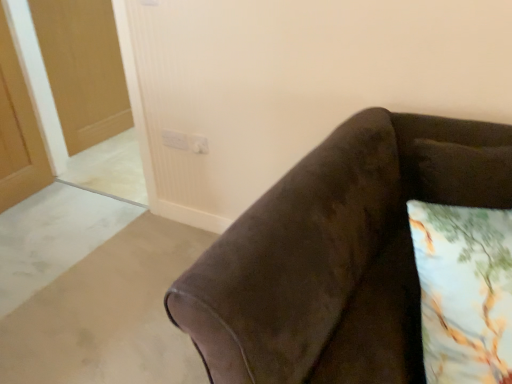
Question: Considering the relative positions of white plastic electric outlet at upper center, which is counted as the first electric outlet, starting from the left, and printed fabric pillow at lower right in the image provided, is white plastic electric outlet at upper center, which is counted as the first electric outlet, starting from the left, to the right of printed fabric pillow at lower right from the viewer's perspective?

Choices:
 (A) no
 (B) yes

Answer: (A)

Question: Is white plastic electric outlet at upper center, which is counted as the first electric outlet, starting from the left, facing away from printed fabric pillow at lower right?

Choices:
 (A) no
 (B) yes

Answer: (A)

Question: Does white plastic electric outlet at upper center, which is counted as the second electric outlet, starting from the right, have a larger size compared to printed fabric pillow at lower right?

Choices:
 (A) yes
 (B) no

Answer: (B)

Question: Is white plastic electric outlet at upper center, which is counted as the second electric outlet, starting from the right, positioned behind printed fabric pillow at lower right?

Choices:
 (A) yes
 (B) no

Answer: (A)

Question: From the image's perspective, is white plastic electric outlet at upper center, which is counted as the second electric outlet, starting from the right, over printed fabric pillow at lower right?

Choices:
 (A) yes
 (B) no

Answer: (A)

Question: Considering the positions of white plastic electric outlet at upper center, which is counted as the second electric outlet, starting from the right, and white plastic electric outlet at upper center, arranged as the first electric outlet when viewed from the right, in the image, is white plastic electric outlet at upper center, which is counted as the second electric outlet, starting from the right, taller or shorter than white plastic electric outlet at upper center, arranged as the first electric outlet when viewed from the right,?

Choices:
 (A) tall
 (B) short

Answer: (B)

Question: Considering the relative positions of white plastic electric outlet at upper center, which is counted as the second electric outlet, starting from the right, and white plastic electric outlet at upper center, arranged as the first electric outlet when viewed from the right, in the image provided, is white plastic electric outlet at upper center, which is counted as the second electric outlet, starting from the right, to the left or to the right of white plastic electric outlet at upper center, arranged as the first electric outlet when viewed from the right,?

Choices:
 (A) right
 (B) left

Answer: (B)

Question: Looking at the image, does white plastic electric outlet at upper center, which is counted as the second electric outlet, starting from the right, seem bigger or smaller compared to white plastic electric outlet at upper center, acting as the second electric outlet starting from the left?

Choices:
 (A) small
 (B) big

Answer: (A)

Question: From a real-world perspective, is white plastic electric outlet at upper center, which is counted as the second electric outlet, starting from the right, physically located above or below white plastic electric outlet at upper center, acting as the second electric outlet starting from the left?

Choices:
 (A) above
 (B) below

Answer: (A)

Question: Is matte wooden door at upper left taller or shorter than printed fabric pillow at lower right?

Choices:
 (A) tall
 (B) short

Answer: (A)

Question: Is matte wooden door at upper left inside the boundaries of printed fabric pillow at lower right, or outside?

Choices:
 (A) outside
 (B) inside

Answer: (A)

Question: Is matte wooden door at upper left in front of or behind printed fabric pillow at lower right in the image?

Choices:
 (A) behind
 (B) front

Answer: (A)

Question: Considering the relative positions of matte wooden door at upper left and printed fabric pillow at lower right in the image provided, is matte wooden door at upper left to the left or to the right of printed fabric pillow at lower right?

Choices:
 (A) right
 (B) left

Answer: (B)

Question: Considering the positions of point (173, 147) and point (456, 377), is point (173, 147) closer or farther from the camera than point (456, 377)?

Choices:
 (A) farther
 (B) closer

Answer: (A)

Question: Considering the positions of white plastic electric outlet at upper center, which is counted as the first electric outlet, starting from the left, and printed fabric pillow at lower right in the image, is white plastic electric outlet at upper center, which is counted as the first electric outlet, starting from the left, taller or shorter than printed fabric pillow at lower right?

Choices:
 (A) tall
 (B) short

Answer: (B)